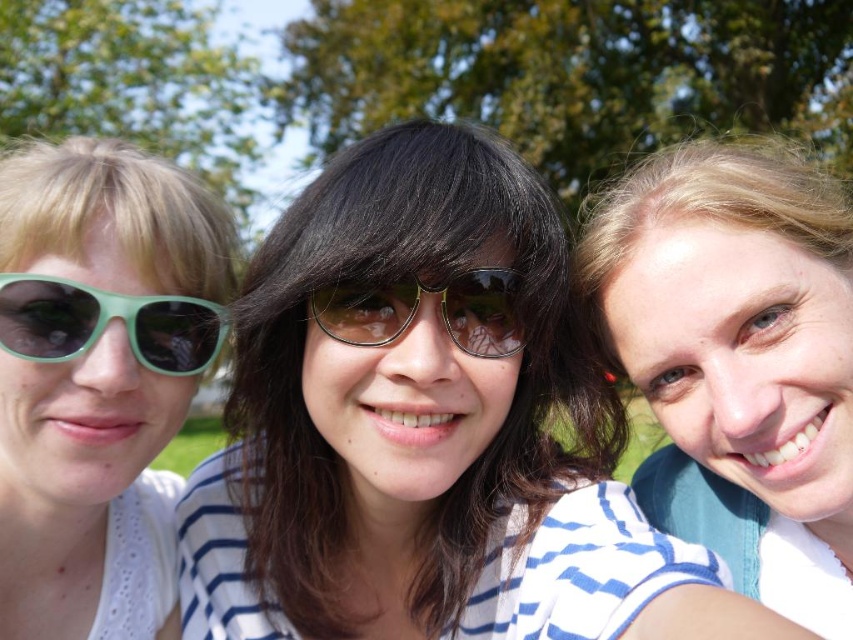
Question: Which point appears closest to the camera in this image?

Choices:
 (A) (503, 305)
 (B) (665, 464)
 (C) (154, 484)
 (D) (45, 356)

Answer: (D)

Question: Which point is closer to the camera?

Choices:
 (A) green matte sunglasses at left
 (B) metallic reflective sunglasses at center
 (C) matte green sunglasses at left
 (D) white striped shirt at center

Answer: (B)

Question: Which point is closer to the camera taking this photo?

Choices:
 (A) (100, 468)
 (B) (747, 195)
 (C) (511, 346)
 (D) (152, 362)

Answer: (A)

Question: Can you confirm if matte black sunglasses at center is positioned to the right of matte green sunglasses at left?

Choices:
 (A) no
 (B) yes

Answer: (B)

Question: Is white striped shirt at center to the right of metallic reflective sunglasses at center from the viewer's perspective?

Choices:
 (A) no
 (B) yes

Answer: (B)

Question: Can you confirm if matte green sunglasses at left is positioned to the right of green matte sunglasses at left?

Choices:
 (A) no
 (B) yes

Answer: (A)